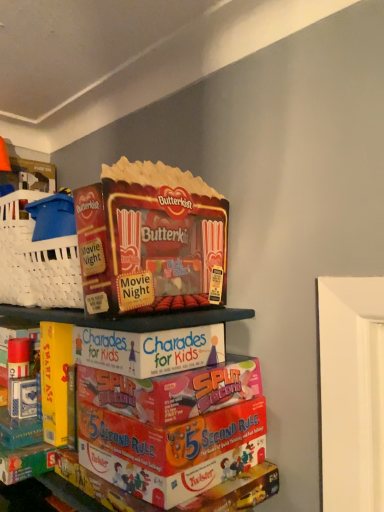
Question: Is matte cardboard butterkist popcorn at upper center touching cardboard game boxes at center?

Choices:
 (A) yes
 (B) no

Answer: (B)

Question: Is matte cardboard butterkist popcorn at upper center aimed at cardboard game boxes at center?

Choices:
 (A) yes
 (B) no

Answer: (B)

Question: Does matte cardboard butterkist popcorn at upper center come in front of cardboard game boxes at center?

Choices:
 (A) yes
 (B) no

Answer: (B)

Question: Is matte cardboard butterkist popcorn at upper center turned away from cardboard game boxes at center?

Choices:
 (A) no
 (B) yes

Answer: (A)

Question: Can you confirm if matte cardboard butterkist popcorn at upper center is shorter than cardboard game boxes at center?

Choices:
 (A) no
 (B) yes

Answer: (B)

Question: Is matte cardboard butterkist popcorn at upper center wider than cardboard game boxes at center?

Choices:
 (A) yes
 (B) no

Answer: (A)

Question: Is cardboard game boxes at center positioned with its back to matte cardboard butterkist popcorn at upper center?

Choices:
 (A) no
 (B) yes

Answer: (A)

Question: Is cardboard game boxes at center completely or partially outside of matte cardboard butterkist popcorn at upper center?

Choices:
 (A) yes
 (B) no

Answer: (A)

Question: Is cardboard game boxes at center smaller than matte cardboard butterkist popcorn at upper center?

Choices:
 (A) no
 (B) yes

Answer: (A)

Question: Is cardboard game boxes at center with matte cardboard butterkist popcorn at upper center?

Choices:
 (A) yes
 (B) no

Answer: (B)

Question: Is cardboard game boxes at center at the right side of matte cardboard butterkist popcorn at upper center?

Choices:
 (A) no
 (B) yes

Answer: (B)

Question: Is cardboard game boxes at center taller than matte cardboard butterkist popcorn at upper center?

Choices:
 (A) yes
 (B) no

Answer: (A)

Question: Visually, is cardboard game boxes at center positioned to the left or to the right of matte cardboard butterkist popcorn at upper center?

Choices:
 (A) right
 (B) left

Answer: (A)